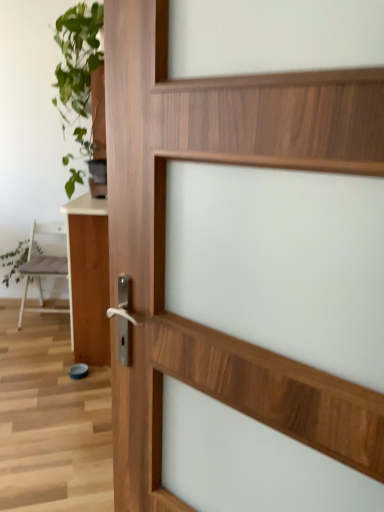
Question: Is white matte chair at left not within white glossy table at left?

Choices:
 (A) yes
 (B) no

Answer: (A)

Question: Is white matte chair at left positioned in front of white glossy table at left?

Choices:
 (A) yes
 (B) no

Answer: (B)

Question: Is white matte chair at left bigger than white glossy table at left?

Choices:
 (A) no
 (B) yes

Answer: (A)

Question: From a real-world perspective, does white matte chair at left sit lower than white glossy table at left?

Choices:
 (A) yes
 (B) no

Answer: (A)

Question: Does white matte chair at left have a greater height compared to white glossy table at left?

Choices:
 (A) yes
 (B) no

Answer: (B)

Question: Is white matte chair at left to the right of white glossy table at left from the viewer's perspective?

Choices:
 (A) no
 (B) yes

Answer: (A)

Question: Is the position of white matte chair at left less distant than that of green leafy plant at left?

Choices:
 (A) no
 (B) yes

Answer: (B)

Question: Is white matte chair at left thinner than green leafy plant at left?

Choices:
 (A) yes
 (B) no

Answer: (B)

Question: Is white matte chair at left next to green leafy plant at left?

Choices:
 (A) no
 (B) yes

Answer: (A)

Question: Is white matte chair at left bigger than green leafy plant at left?

Choices:
 (A) no
 (B) yes

Answer: (B)

Question: From a real-world perspective, is white matte chair at left on top of green leafy plant at left?

Choices:
 (A) yes
 (B) no

Answer: (A)

Question: Can you confirm if white matte chair at left is positioned to the right of green leafy plant at left?

Choices:
 (A) yes
 (B) no

Answer: (A)

Question: Is white glossy table at left turned away from green leafy plant at upper left?

Choices:
 (A) no
 (B) yes

Answer: (A)